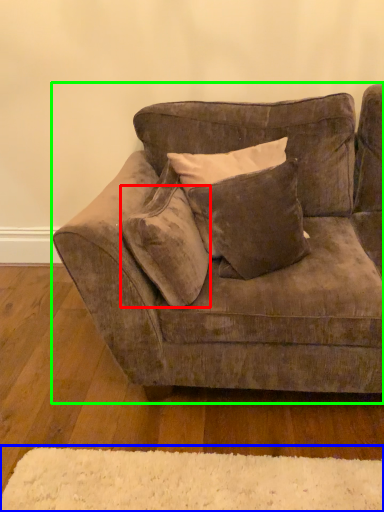
Question: Which is farther away from pillow (highlighted by a red box)? mat (highlighted by a blue box) or studio couch (highlighted by a green box)?

Choices:
 (A) mat
 (B) studio couch

Answer: (A)